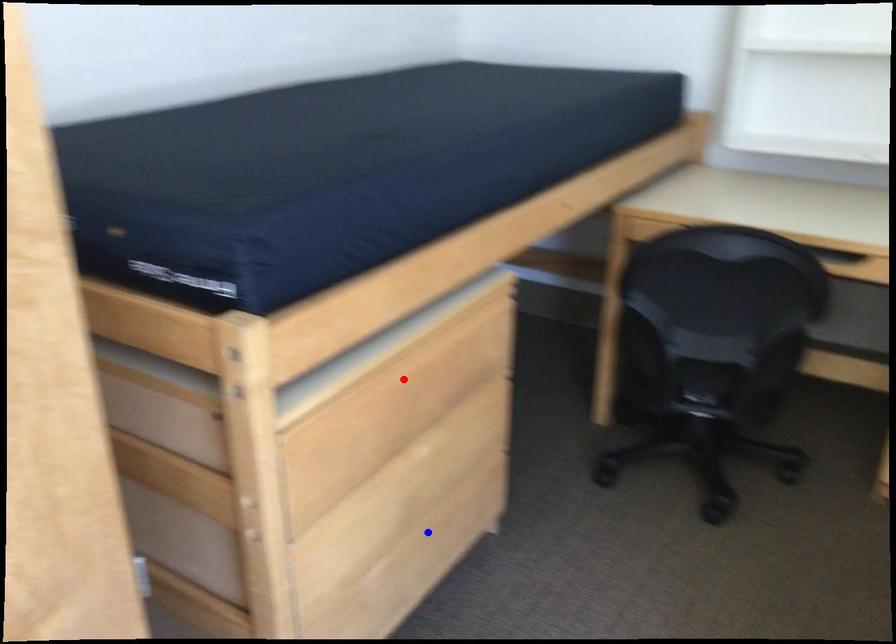
Question: Which of the two points in the image is closer to the camera?

Choices:
 (A) Blue point is closer.
 (B) Red point is closer.

Answer: (B)